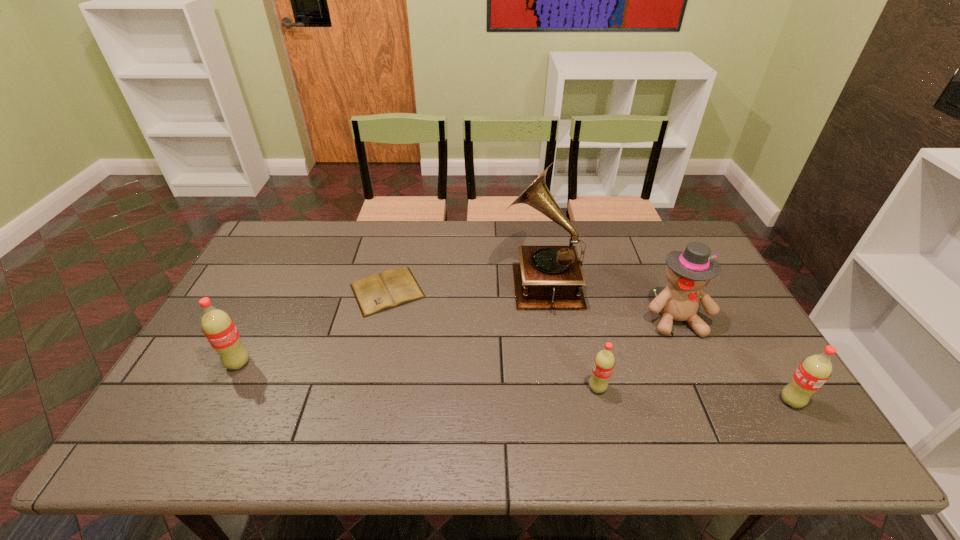
Locate which soda is the third closest to the second object from right to left. Please provide its 2D coordinates. Your answer should be formatted as a tuple, i.e. [(x, y)], where the tuple contains the x and y coordinates of a point satisfying the conditions above.

[(218, 327)]

The width and height of the screenshot is (960, 540). In order to click on the second closest soda to the shortest soda in this screenshot , I will do `click(218, 327)`.

The height and width of the screenshot is (540, 960). I want to click on free region that satisfies the following two spatial constraints: 1. on the front-facing side of the fifth object from left to right; 2. on the right side of the fourth tallest object, so click(713, 401).

Where is `free space that satisfies the following two spatial constraints: 1. on the front side of the rightmost object; 2. on the right side of the book`? free space that satisfies the following two spatial constraints: 1. on the front side of the rightmost object; 2. on the right side of the book is located at coordinates pyautogui.click(x=362, y=401).

Locate an element on the screen. The width and height of the screenshot is (960, 540). free space in the image that satisfies the following two spatial constraints: 1. on the back side of the rightmost soda; 2. on the horn of the record player is located at coordinates (718, 282).

I want to click on vacant region that satisfies the following two spatial constraints: 1. on the horn of the record player; 2. on the left side of the rightmost object, so click(560, 401).